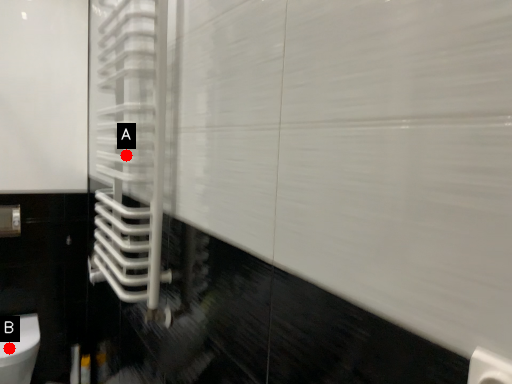
Question: Two points are circled on the image, labeled by A and B beside each circle. Which point is farther to the camera?

Choices:
 (A) A is further
 (B) B is further

Answer: (B)